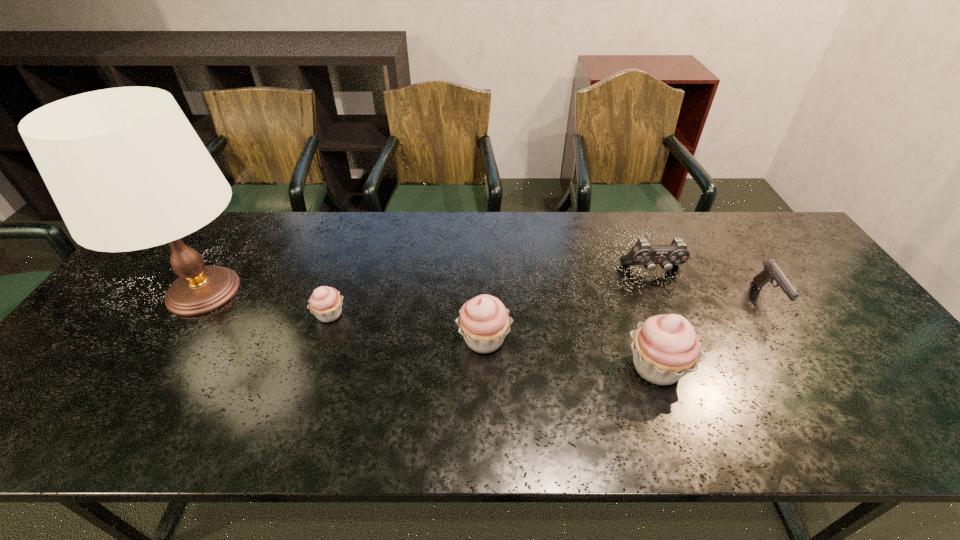
Locate an element on the screen. The image size is (960, 540). free space located 0.170m on the back of the second tallest cupcake is located at coordinates (484, 275).

Locate an element on the screen. This screenshot has height=540, width=960. vacant region located 0.380m on the back of the rightmost cupcake is located at coordinates (614, 246).

Find the location of a particular element. The image size is (960, 540). free space located on the surface of the control with buttons is located at coordinates (690, 359).

Locate an element on the screen. The height and width of the screenshot is (540, 960). free space located on the front of the leftmost object is located at coordinates click(x=133, y=401).

Where is `free space located 0.180m at the barrel of the pistol`? The height and width of the screenshot is (540, 960). free space located 0.180m at the barrel of the pistol is located at coordinates (819, 378).

Find the location of `object that is at the far edge`. object that is at the far edge is located at coordinates (127, 171).

You are a GUI agent. You are given a task and a screenshot of the screen. Output one action in this format:
    pyautogui.click(x=<x>, y=<y>)
    Task: Click on the object at the near edge
    
    Given the screenshot: What is the action you would take?
    pyautogui.click(x=665, y=348)

The height and width of the screenshot is (540, 960). Find the location of `object that is at the left edge`. object that is at the left edge is located at coordinates (127, 171).

You are a GUI agent. You are given a task and a screenshot of the screen. Output one action in this format:
    pyautogui.click(x=<x>, y=<y>)
    Task: Click on the object that is at the far left corner
    
    Given the screenshot: What is the action you would take?
    pyautogui.click(x=127, y=171)

Where is `vacant region at the far edge of the desktop`? The image size is (960, 540). vacant region at the far edge of the desktop is located at coordinates (577, 213).